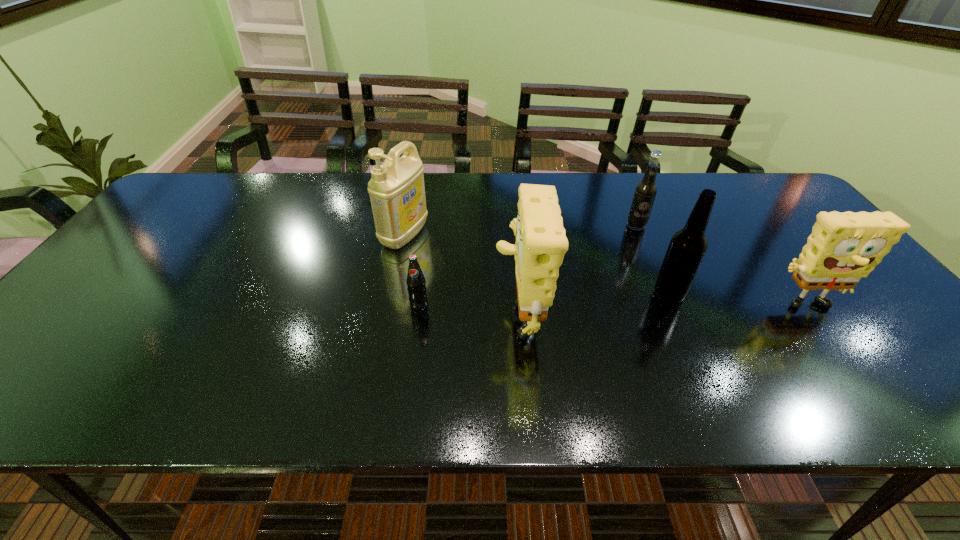
In the image, there is a desktop. Where is `free region at the left edge`? The width and height of the screenshot is (960, 540). free region at the left edge is located at coordinates (127, 293).

Where is `free space at the right edge`? free space at the right edge is located at coordinates (791, 251).

The width and height of the screenshot is (960, 540). What are the coordinates of `vacant space that is in between the left sponge and the root beer` in the screenshot? It's located at (578, 269).

This screenshot has width=960, height=540. I want to click on free space between the beer bottle and the root beer, so click(x=653, y=260).

Locate an element on the screen. This screenshot has height=540, width=960. empty space between the rightmost object and the shortest object is located at coordinates (611, 306).

This screenshot has width=960, height=540. I want to click on vacant point located between the fourth object from right to left and the detergent, so click(x=462, y=274).

Where is `free space between the rightmost object and the detergent`? This screenshot has width=960, height=540. free space between the rightmost object and the detergent is located at coordinates tap(603, 271).

Locate an element on the screen. This screenshot has width=960, height=540. vacant point located between the right sponge and the beer bottle is located at coordinates click(x=735, y=301).

Locate an element on the screen. The height and width of the screenshot is (540, 960). object that is the fifth nearest to the detergent is located at coordinates (843, 247).

The width and height of the screenshot is (960, 540). Identify the location of object that is the fourth closest to the root beer. (397, 192).